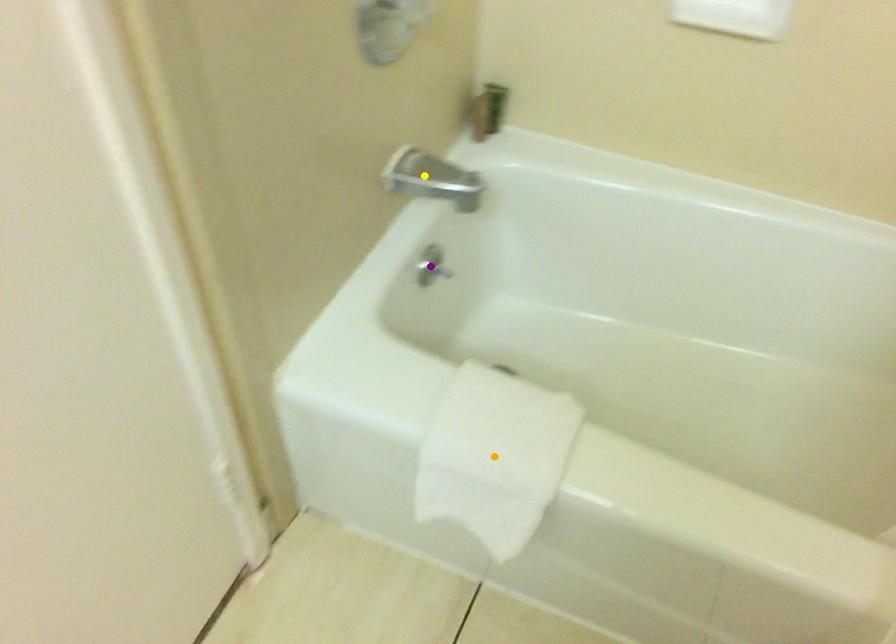
Looking at this image, order these from nearest to farthest:
yellow point
purple point
orange point

orange point → yellow point → purple point